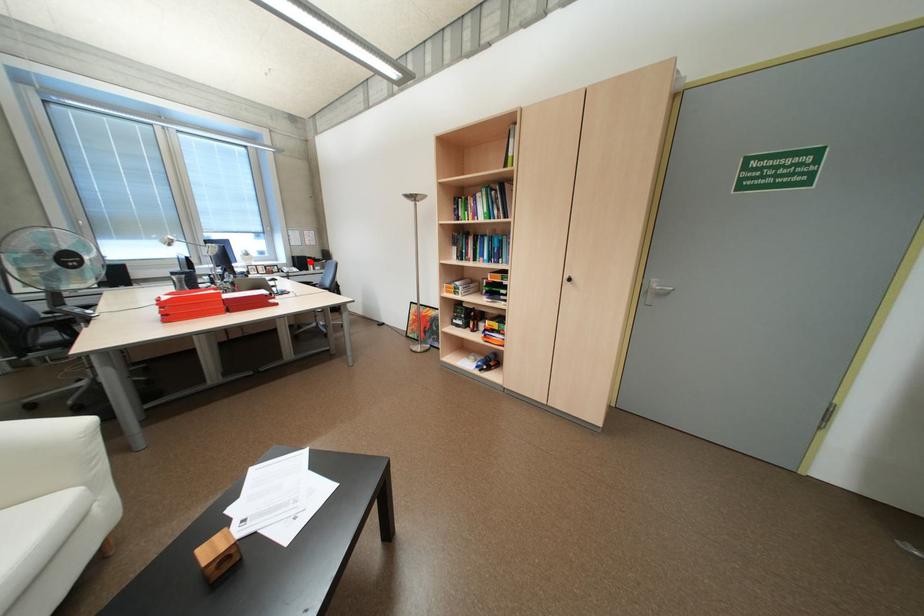
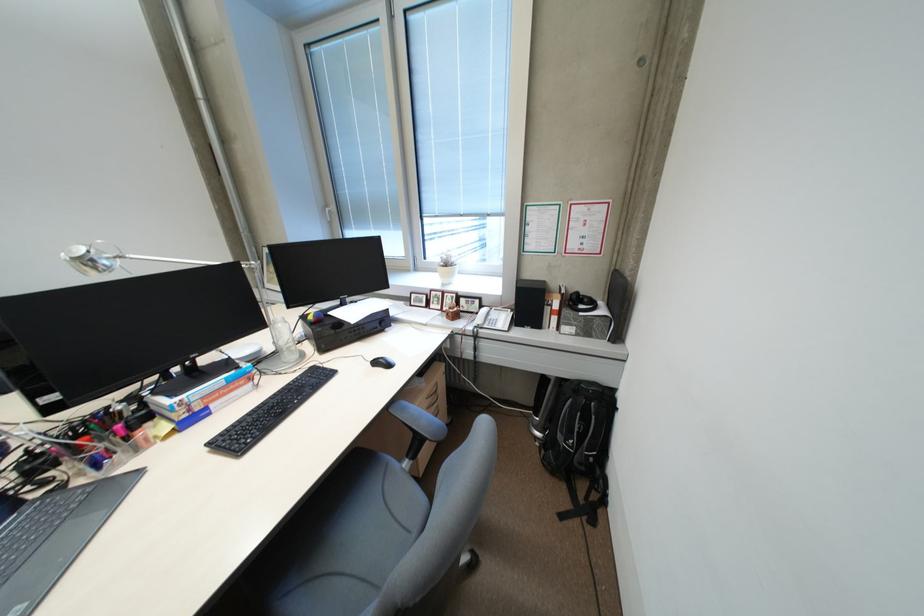
Question: I am providing you with two images of the same scene from different viewpoints. Given a red point in image1, look at the same physical point in image2. Is it:

Choices:
 (A) Closer to the viewpoint
 (B) Farther from the viewpoint

Answer: (B)